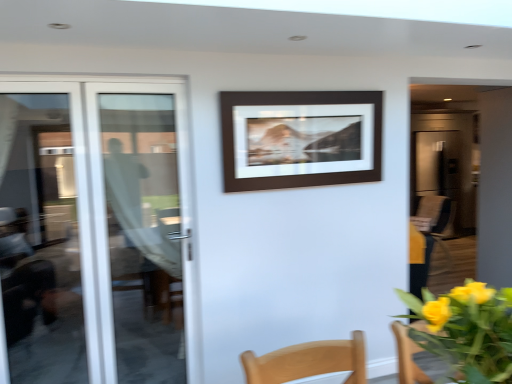
Question: Is brown matte picture frame at center inside or outside of white glass door at left, positioned as the 2th door in right-to-left order?

Choices:
 (A) outside
 (B) inside

Answer: (A)

Question: Is brown matte picture frame at center taller or shorter than white glass door at left, acting as the first door starting from the left?

Choices:
 (A) tall
 (B) short

Answer: (B)

Question: Which object is the closest to the transparent glass door at left, arranged as the 2th door when viewed from the left?

Choices:
 (A) brown matte picture frame at center
 (B) white glass door at left, positioned as the 2th door in right-to-left order
 (C) yellow matte flowers at lower right
 (D) metallic silver refrigerator at right

Answer: (B)

Question: Considering the real-world distances, which object is closest to the brown matte picture frame at center?

Choices:
 (A) metallic silver refrigerator at right
 (B) transparent glass door at left, arranged as the 2th door when viewed from the left
 (C) white glass door at left, acting as the first door starting from the left
 (D) yellow matte flowers at lower right

Answer: (D)